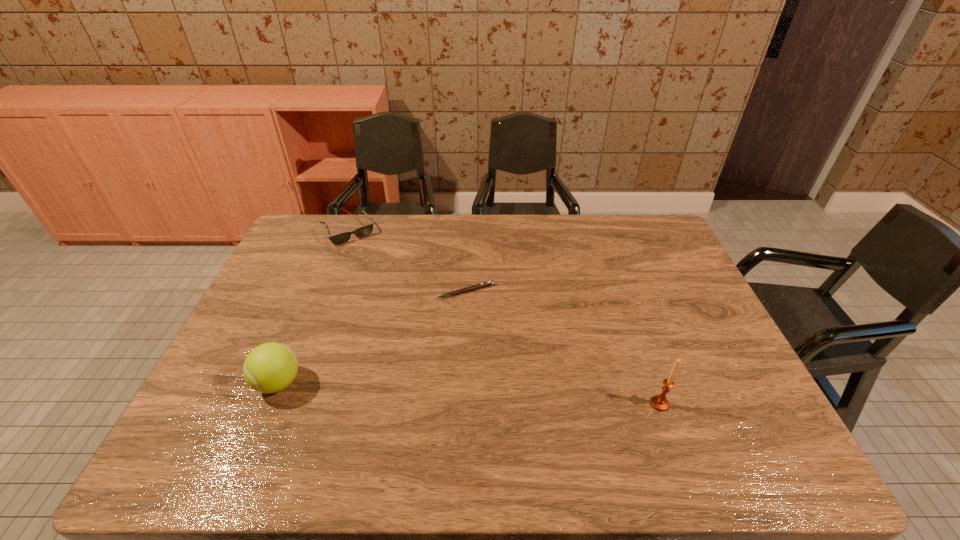
Identify the location of vacant region located 0.140m at the nib of the third nearest object. The image size is (960, 540). (449, 334).

Locate an element on the screen. The height and width of the screenshot is (540, 960). vacant space located at the nib of the third nearest object is located at coordinates (433, 384).

The image size is (960, 540). I want to click on free space located 0.110m on the front-facing side of the third tallest object, so click(x=370, y=261).

Where is `vacant space located 0.140m on the front-facing side of the third tallest object`? vacant space located 0.140m on the front-facing side of the third tallest object is located at coordinates (372, 267).

Locate an element on the screen. This screenshot has width=960, height=540. free space located 0.270m on the front-facing side of the third tallest object is located at coordinates (388, 289).

Locate an element on the screen. This screenshot has width=960, height=540. object located in the far edge section of the desktop is located at coordinates (363, 231).

You are a GUI agent. You are given a task and a screenshot of the screen. Output one action in this format:
    pyautogui.click(x=<x>, y=<y>)
    Task: Click on the tennis ball that is at the near edge
    
    Given the screenshot: What is the action you would take?
    pyautogui.click(x=269, y=368)

Where is `candle_holder that is at the near edge`? The width and height of the screenshot is (960, 540). candle_holder that is at the near edge is located at coordinates (659, 402).

Where is `tennis ball that is at the left edge`? This screenshot has width=960, height=540. tennis ball that is at the left edge is located at coordinates (269, 368).

Identify the location of sunglasses positioned at the left edge. (363, 231).